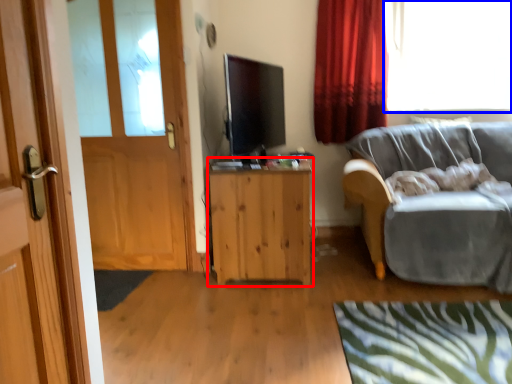
Question: Which point is further to the camera, cabinetry (highlighted by a red box) or window (highlighted by a blue box)?

Choices:
 (A) cabinetry
 (B) window

Answer: (B)